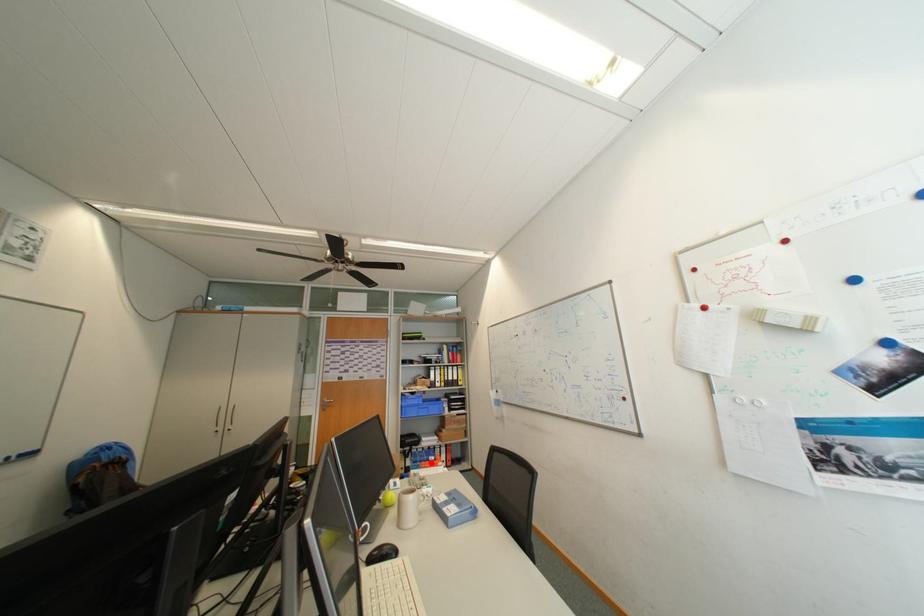
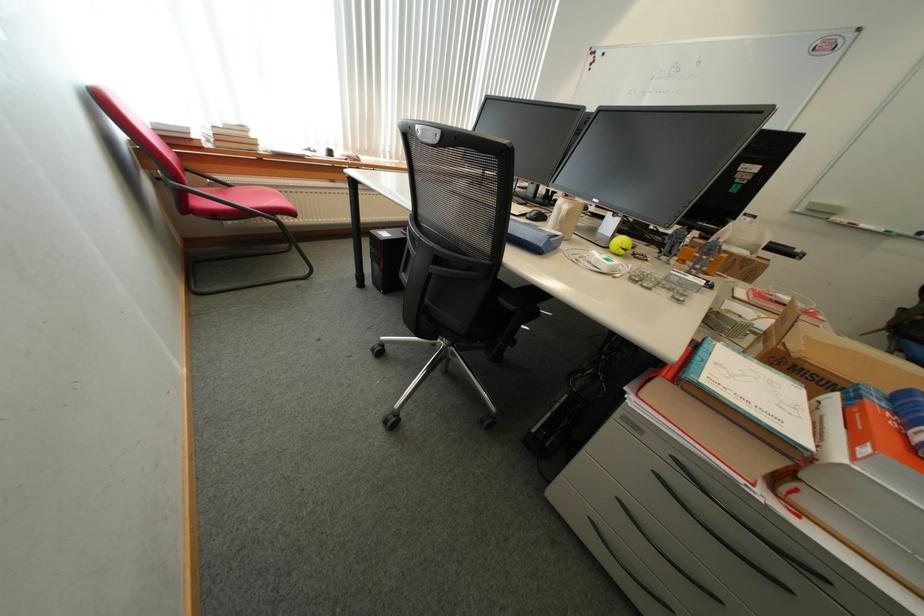
Where in the second image is the point corresponding to the highlighted location from the first image?

(906, 415)